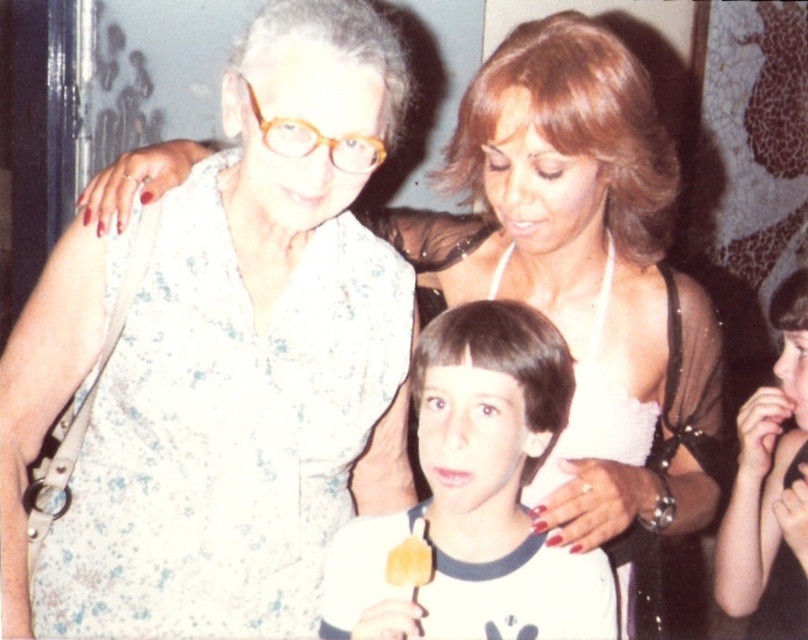
Question: Does smooth white shirt at center have a larger size compared to smooth black hair at center?

Choices:
 (A) no
 (B) yes

Answer: (A)

Question: Which of the following is the farthest from the observer?

Choices:
 (A) (583, 582)
 (B) (398, 564)

Answer: (A)

Question: Which point is closer to the camera?

Choices:
 (A) (533, 362)
 (B) (764, 557)
 (C) (410, 566)
 (D) (384, 465)

Answer: (C)

Question: Can you confirm if smooth black hair at center is positioned to the right of yellow matte cookie at center?

Choices:
 (A) yes
 (B) no

Answer: (A)

Question: Can you confirm if smooth white shirt at center is smaller than yellow matte cookie at center?

Choices:
 (A) no
 (B) yes

Answer: (A)

Question: Which object is positioned farthest from the smooth white shirt at center?

Choices:
 (A) yellow matte cookie at center
 (B) floral fabric blouse at center
 (C) smooth black hair at center

Answer: (C)